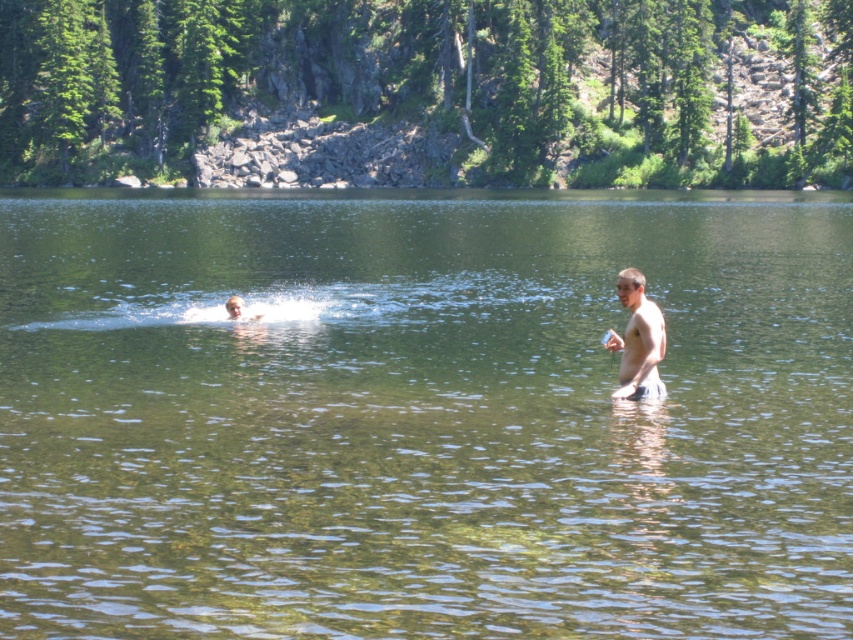
Does clear water at center appear over skinny white man at right?

Yes.

Who is taller, clear water at center or skinny white man at right?

clear water at center is taller.

This screenshot has width=853, height=640. What are the coordinates of `clear water at center` in the screenshot? It's located at (421, 417).